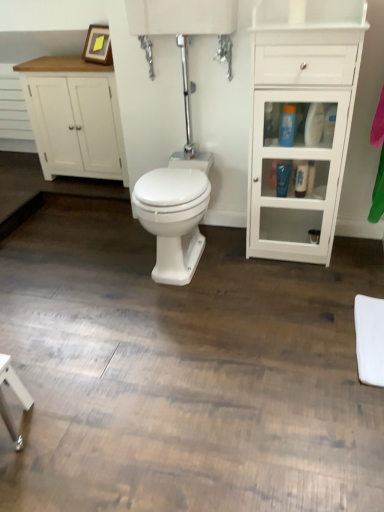
Question: Which is correct: wooden picture frame at upper left is inside white wood cabinet at left, which appears as the 2th bathroom cabinet when viewed from the right, or outside of it?

Choices:
 (A) inside
 (B) outside

Answer: (B)

Question: From the image's perspective, is wooden picture frame at upper left above or below white wood cabinet at left, the second bathroom cabinet viewed from the front?

Choices:
 (A) above
 (B) below

Answer: (A)

Question: Based on their relative distances, which object is nearer to the blue glossy lotion at center right, positioned as the second toiletry in bottom-to-top order?

Choices:
 (A) blue glossy bottle at center right, which is counted as the third toiletry, starting from the bottom
 (B) white wood cabinet at left, positioned as the 1th bathroom cabinet in left-to-right order
 (C) white glossy cabinet at right, which is counted as the 2th bathroom cabinet, starting from the back
 (D) wooden picture frame at upper left
 (E) white glossy bottle at right, the first toiletry when ordered from bottom to top

Answer: (E)

Question: Which of these objects is positioned closest to the blue glossy lotion at center right, which appears as the second toiletry when viewed from the top?

Choices:
 (A) wooden picture frame at upper left
 (B) white glossy bidet at center
 (C) white glossy cabinet at right, positioned as the 1th bathroom cabinet in front-to-back order
 (D) blue glossy bottle at center right, which is counted as the third toiletry, starting from the bottom
 (E) white wood cabinet at left, positioned as the 1th bathroom cabinet in left-to-right order

Answer: (D)